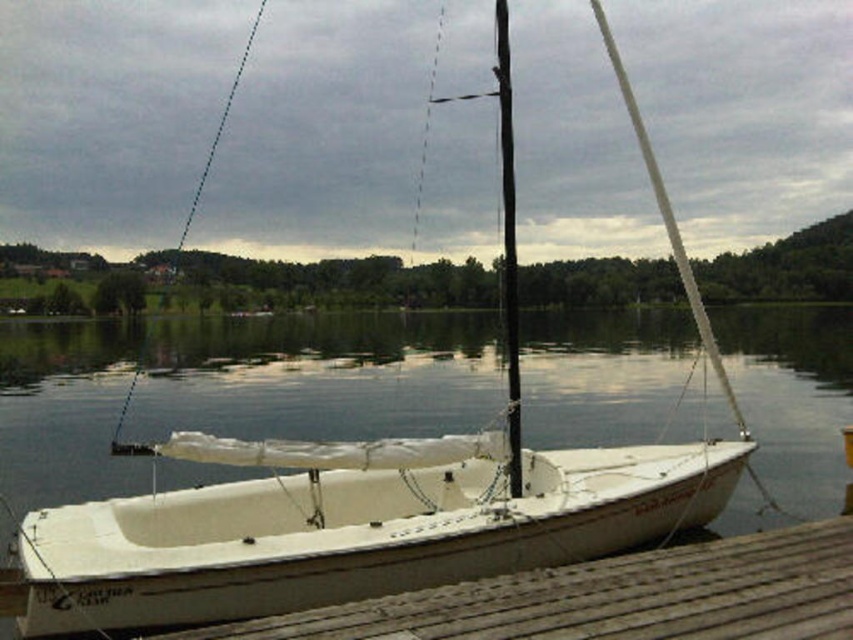
Is point (257, 593) closer to viewer compared to point (822, 600)?

No, (257, 593) is behind (822, 600).

Between point (258, 605) and point (585, 563), which one is positioned behind?

The point (585, 563) is behind.

Locate an element on the screen. white matte sailboat at center is located at coordinates (351, 525).

How much distance is there between white matte water at center and white matte sailboat at center?

The distance of white matte water at center from white matte sailboat at center is 38.59 meters.

Looking at this image, measure the distance between white matte water at center and white matte sailboat at center.

white matte water at center and white matte sailboat at center are 126.60 feet apart.

Identify the location of white matte water at center. Image resolution: width=853 pixels, height=640 pixels. (320, 376).

In order to click on white matte water at center in this screenshot , I will do `click(320, 376)`.

What do you see at coordinates (320, 376) in the screenshot?
I see `white matte water at center` at bounding box center [320, 376].

Is white matte water at center taller than wooden at lower left?

Correct, white matte water at center is much taller as wooden at lower left.

This screenshot has height=640, width=853. Identify the location of white matte water at center. (320, 376).